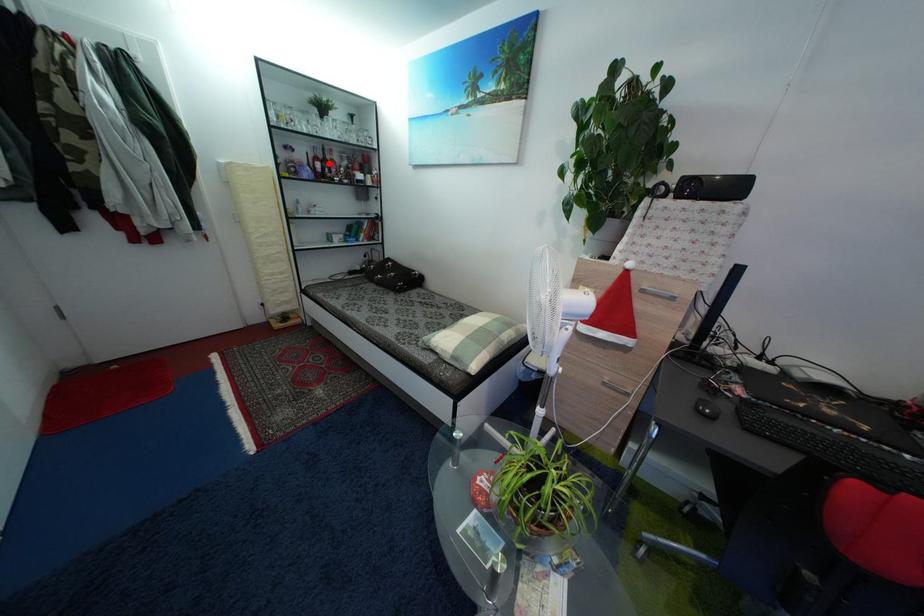
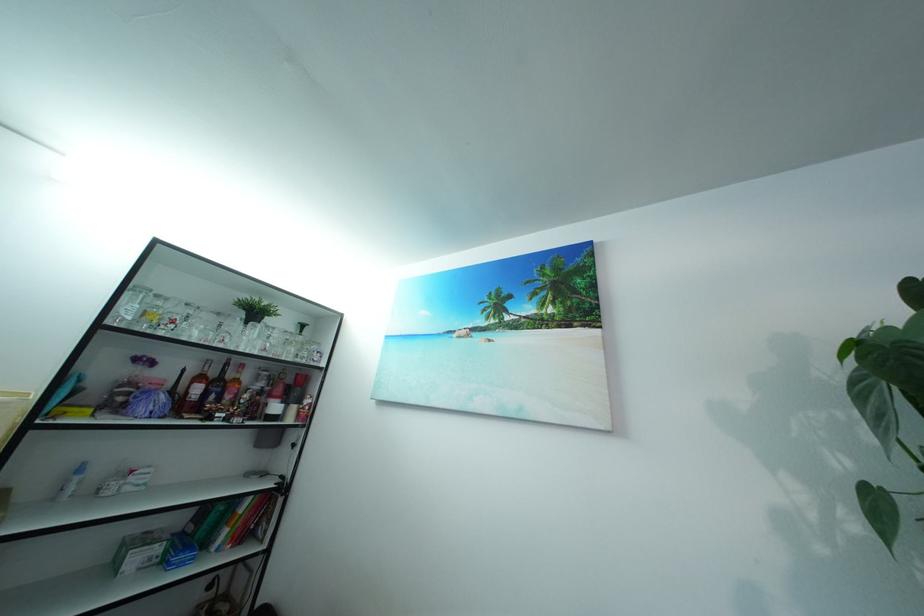
Question: A red point is marked in image1. In image2, is the corresponding 3D point closer to the camera or farther? Reply with the corresponding letter.

Choices:
 (A) The corresponding 3D point is closer.
 (B) The corresponding 3D point is farther.

Answer: (B)